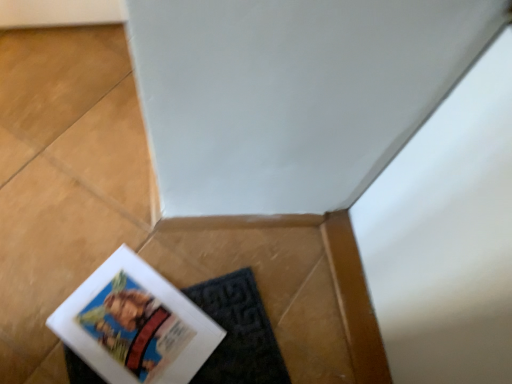
The height and width of the screenshot is (384, 512). Describe the element at coordinates (135, 324) in the screenshot. I see `white matte book at lower left` at that location.

Find the location of a particular element. white matte book at lower left is located at coordinates (135, 324).

The height and width of the screenshot is (384, 512). What are the coordinates of `white matte book at lower left` in the screenshot? It's located at (135, 324).